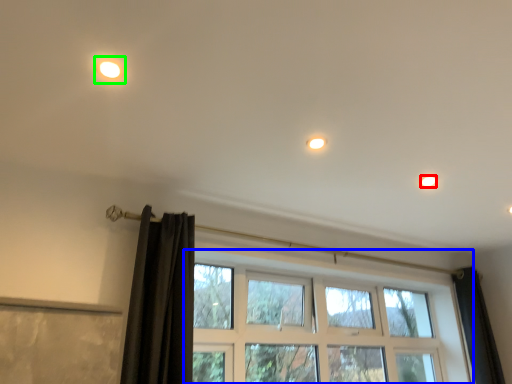
Question: Which object is the closest to the dot (highlighted by a red box)? Choose among these: window (highlighted by a blue box) or light (highlighted by a green box).

Choices:
 (A) window
 (B) light

Answer: (A)